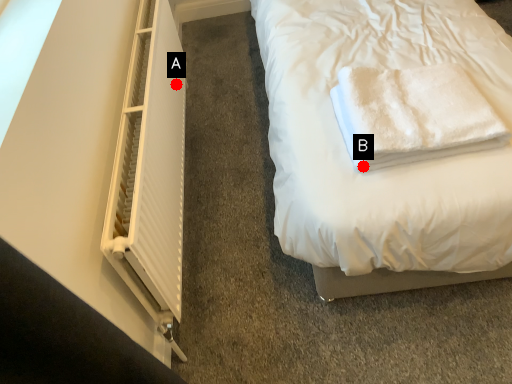
Question: Two points are circled on the image, labeled by A and B beside each circle. Which of the following is the farthest from the observer?

Choices:
 (A) A is further
 (B) B is further

Answer: (A)